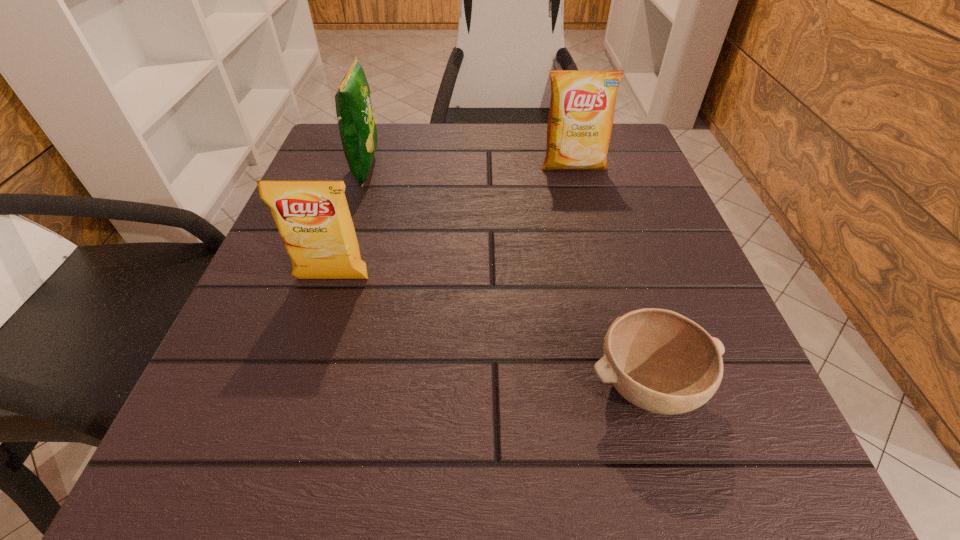
Find the location of a particular element. This screenshot has width=960, height=540. object positioned at the far left corner is located at coordinates (358, 132).

The height and width of the screenshot is (540, 960). Find the location of `object present at the far right corner`. object present at the far right corner is located at coordinates (582, 105).

You are a GUI agent. You are given a task and a screenshot of the screen. Output one action in this format:
    pyautogui.click(x=<x>, y=<y>)
    Task: Click on the object at the near right corner
    
    Given the screenshot: What is the action you would take?
    pyautogui.click(x=659, y=360)

What are the coordinates of `blank space at the far edge of the desktop` in the screenshot? It's located at (425, 165).

The width and height of the screenshot is (960, 540). I want to click on vacant space at the near edge, so point(356,450).

Where is `vacant region at the left edge`? vacant region at the left edge is located at coordinates (372, 234).

In the image, there is a desktop. Identify the location of free space at the right edge. The width and height of the screenshot is (960, 540). (592, 209).

In the image, there is a desktop. Where is `vacant space at the far left corner`? vacant space at the far left corner is located at coordinates (383, 130).

In the image, there is a desktop. Where is `free space at the near left corner`? The image size is (960, 540). free space at the near left corner is located at coordinates (177, 465).

Find the location of a particular element. vacant space at the near right corner of the desktop is located at coordinates click(668, 502).